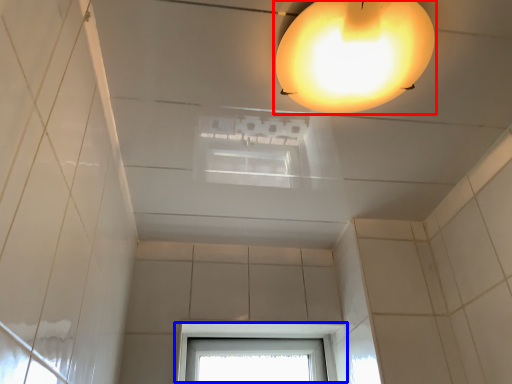
Question: Which point is closer to the camera, lamp (highlighted by a red box) or window (highlighted by a blue box)?

Choices:
 (A) lamp
 (B) window

Answer: (A)